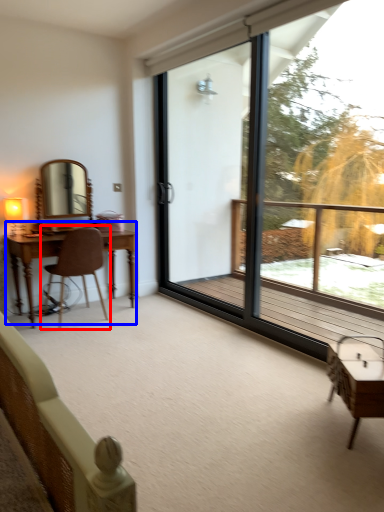
Question: Which object appears closest to the camera in this image, chair (highlighted by a red box) or table (highlighted by a blue box)?

Choices:
 (A) chair
 (B) table

Answer: (A)